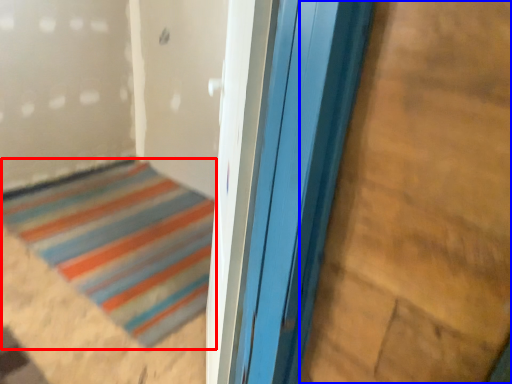
Question: Which object is closer to the camera taking this photo, door (highlighted by a red box) or plywood (highlighted by a blue box)?

Choices:
 (A) door
 (B) plywood

Answer: (B)